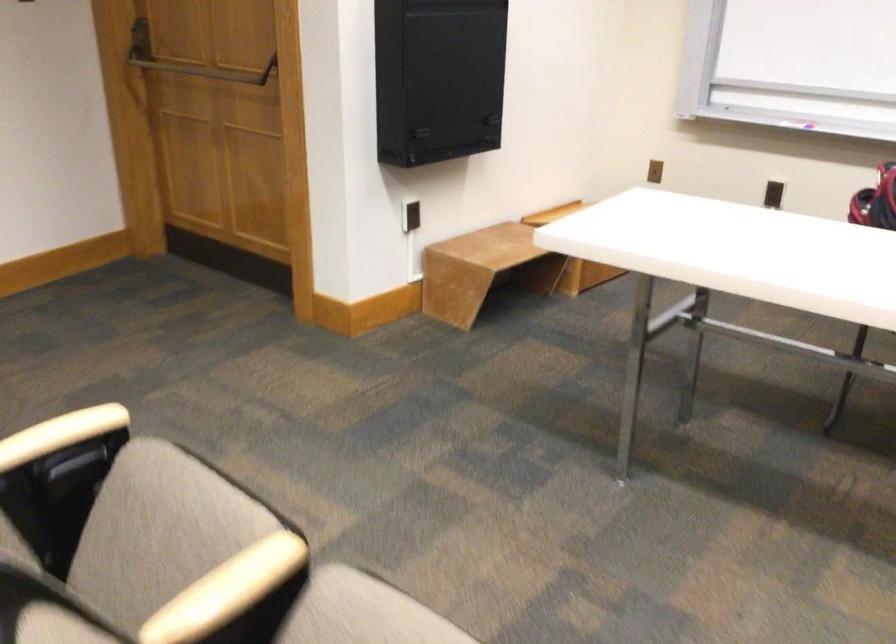
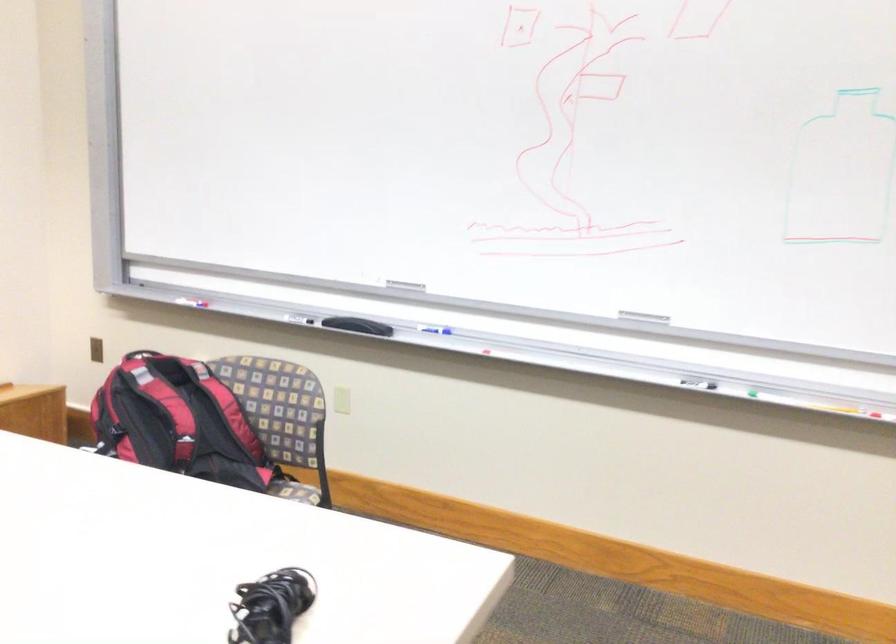
Question: In a continuous first-person perspective shot, in which direction is the camera moving?

Choices:
 (A) Left
 (B) Right
 (C) Forward
 (D) Backward

Answer: (B)